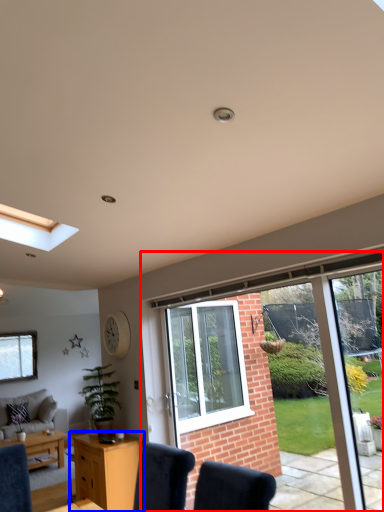
Question: Among these objects, which one is nearest to the camera, window (highlighted by a red box) or desk (highlighted by a blue box)?

Choices:
 (A) window
 (B) desk

Answer: (A)